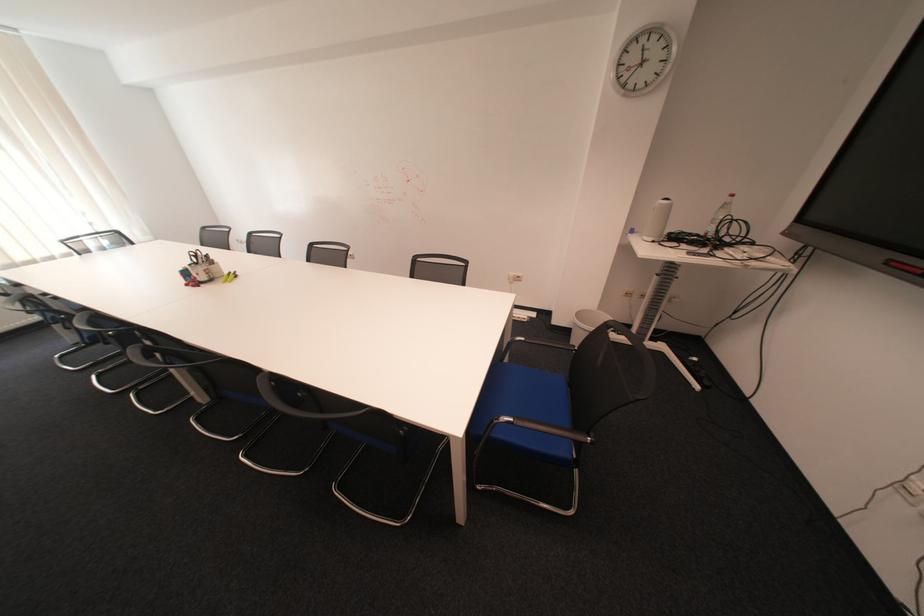
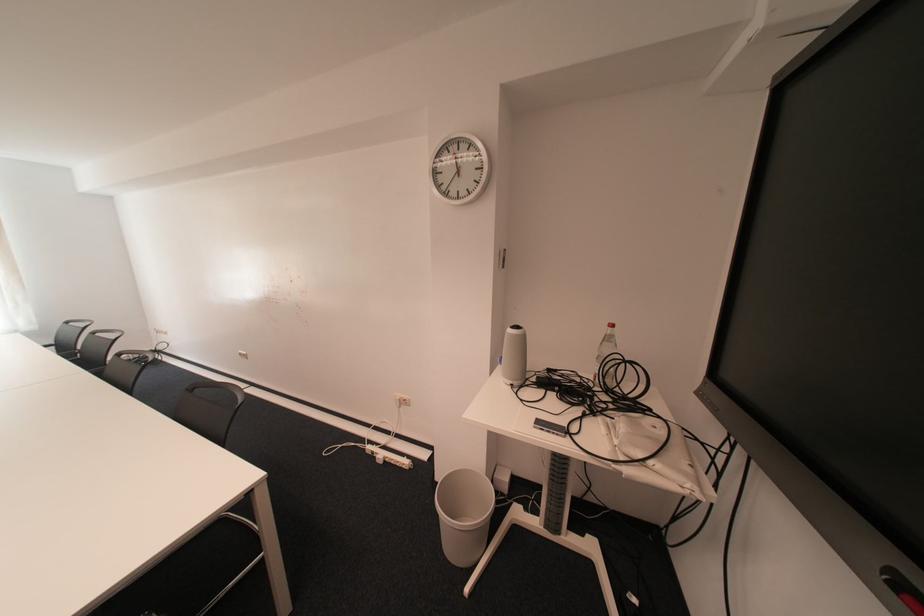
The images are taken continuously from a first-person perspective. In which direction are you moving?

The cameraman moved toward right, forward.